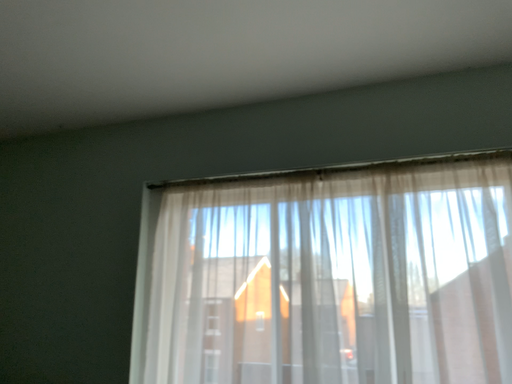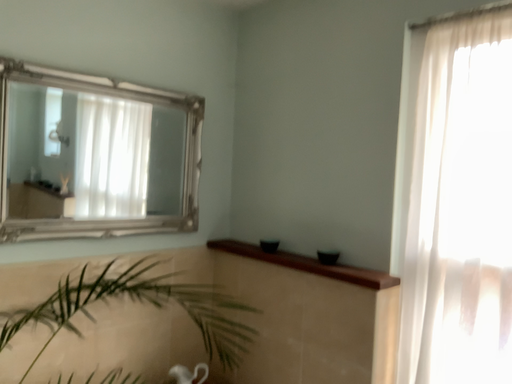
Question: Which way did the camera rotate in the video?

Choices:
 (A) rotated downward
 (B) rotated upward

Answer: (A)